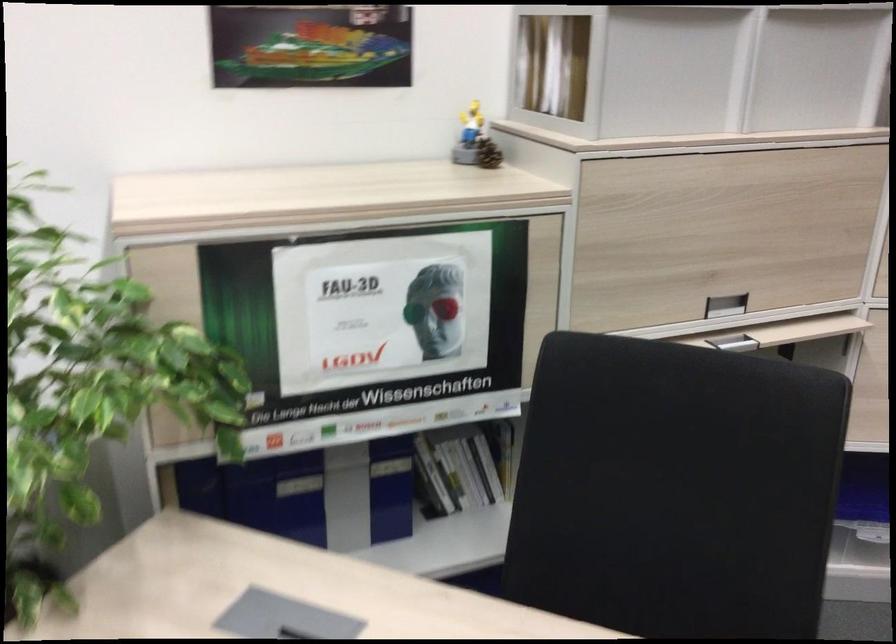
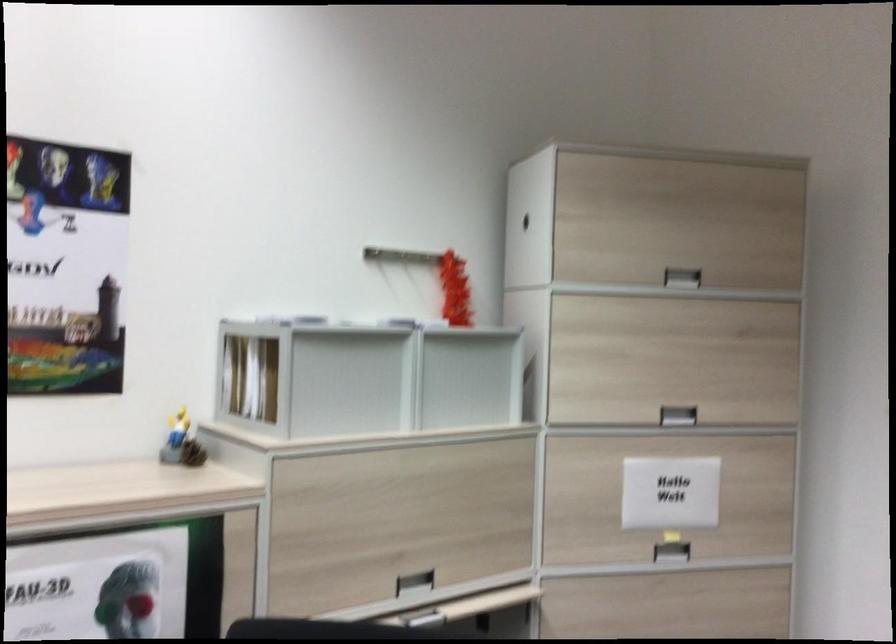
The images are taken continuously from a first-person perspective. In which direction is your viewpoint rotating?

The camera rotated toward right-up.